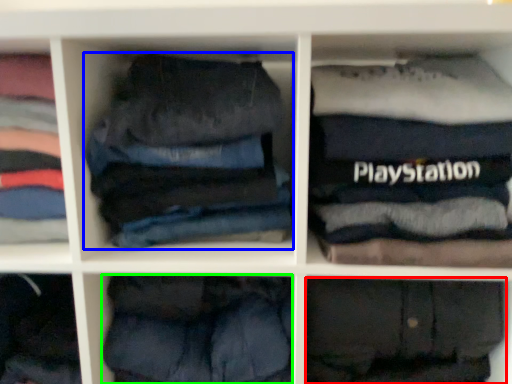
Question: Which object is the closest to the trousers (highlighted by a red box)? Choose among these: trousers (highlighted by a blue box) or trousers (highlighted by a green box).

Choices:
 (A) trousers
 (B) trousers

Answer: (B)